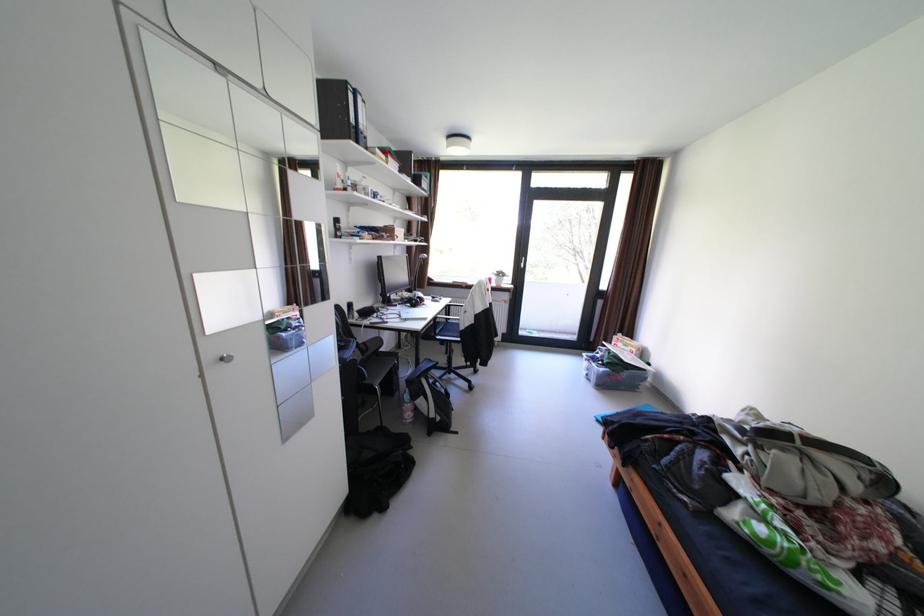
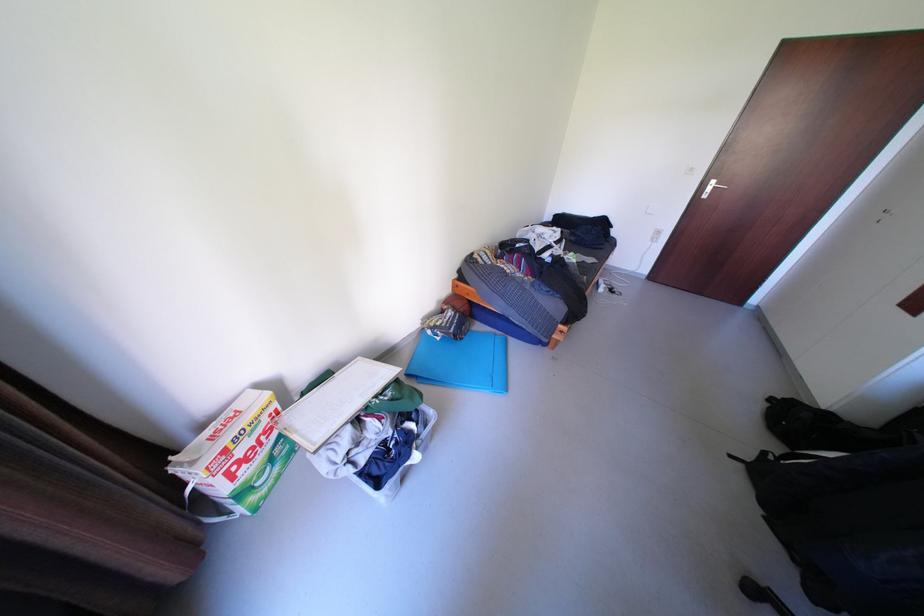
The point at (609,355) is marked in the first image. Where is the corresponding point in the second image?

(372, 459)